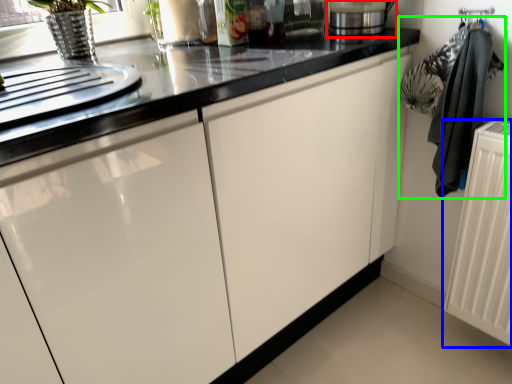
Question: Which is nearer to the appliance (highlighted by a red box)? radiator (highlighted by a blue box) or laundry (highlighted by a green box).

Choices:
 (A) radiator
 (B) laundry

Answer: (B)